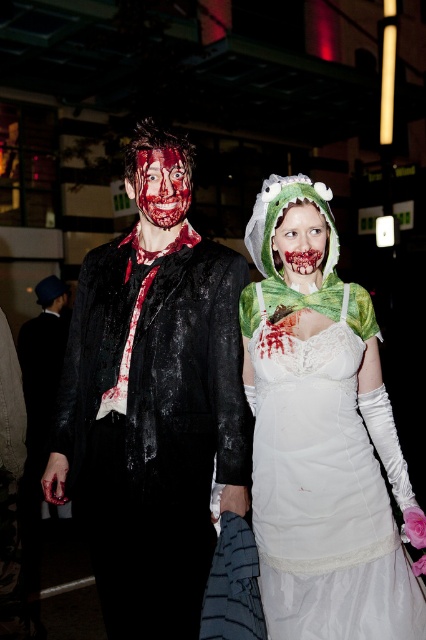
Question: Which point appears closest to the camera in this image?

Choices:
 (A) (304, 422)
 (B) (321, 241)

Answer: (A)

Question: Which point is farther to the camera?

Choices:
 (A) white lace dress at center
 (B) bloodied flesh face at center
 (C) blood-stained fabric face at center

Answer: (B)

Question: Observing the image, what is the correct spatial positioning of white lace dress at center in reference to bloodied flesh face at center?

Choices:
 (A) right
 (B) left

Answer: (A)

Question: Can you confirm if white lace dress at center is wider than bloodied flesh face at center?

Choices:
 (A) no
 (B) yes

Answer: (B)

Question: Can you confirm if white lace dress at center is positioned to the left of bloodied flesh face at center?

Choices:
 (A) yes
 (B) no

Answer: (B)

Question: Among these points, which one is nearest to the camera?

Choices:
 (A) (313, 236)
 (B) (138, 163)
 (C) (363, 316)

Answer: (A)